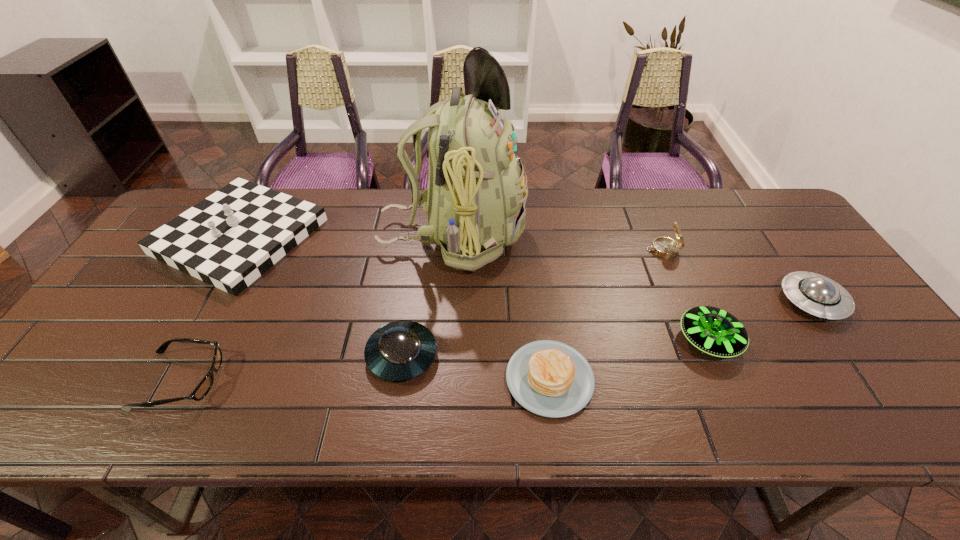
Point out which object is positioned as the sixth nearest to the spectacles. Please provide its 2D coordinates. Your answer should be formatted as a tuple, i.e. [(x, y)], where the tuple contains the x and y coordinates of a point satisfying the conditions above.

[(664, 247)]

Select which object is the sixth closest to the compass. Please provide its 2D coordinates. Your answer should be formatted as a tuple, i.e. [(x, y)], where the tuple contains the x and y coordinates of a point satisfying the conditions above.

[(228, 240)]

Identify the location of saucer that is the second closest to the spectacles. This screenshot has height=540, width=960. (714, 331).

Choose which saucer is the second nearest neighbor to the rightmost object. Please provide its 2D coordinates. Your answer should be formatted as a tuple, i.e. [(x, y)], where the tuple contains the x and y coordinates of a point satisfying the conditions above.

[(401, 350)]

Find the location of a particular element. This screenshot has width=960, height=540. free spot that satisfies the following two spatial constraints: 1. with the dial facing the third tallest object; 2. on the front side of the leftmost saucer is located at coordinates 708,355.

The image size is (960, 540). Find the location of `vacant position in the image that satisfies the following two spatial constraints: 1. on the front side of the leftmost saucer; 2. on the front-facing side of the spectacles`. vacant position in the image that satisfies the following two spatial constraints: 1. on the front side of the leftmost saucer; 2. on the front-facing side of the spectacles is located at coordinates (398, 380).

The image size is (960, 540). I want to click on free space that satisfies the following two spatial constraints: 1. on the front-facing side of the tallest object; 2. on the right side of the rightmost object, so click(448, 301).

Find the location of `blank space that satisfies the following two spatial constraints: 1. with the dial facing the third tallest object; 2. on the front side of the pancake`. blank space that satisfies the following two spatial constraints: 1. with the dial facing the third tallest object; 2. on the front side of the pancake is located at coordinates (718, 379).

The width and height of the screenshot is (960, 540). I want to click on free space that satisfies the following two spatial constraints: 1. on the front-facing side of the pancake; 2. on the right side of the tallest object, so click(x=443, y=379).